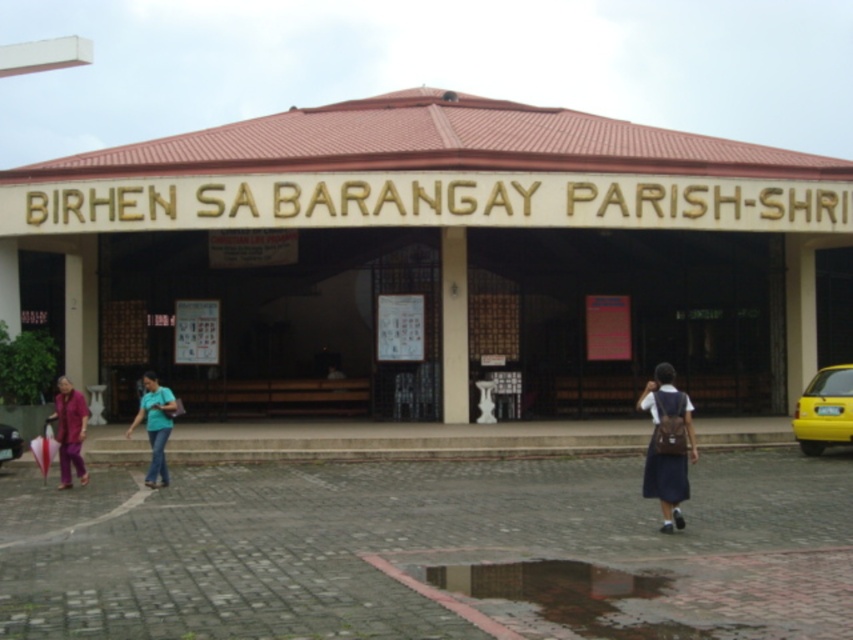
From the picture: Is matte purple pants at lower left further to camera compared to yellow matte car at lower right?

No, it is not.

Does matte purple pants at lower left have a smaller size compared to yellow matte car at lower right?

Incorrect, matte purple pants at lower left is not smaller in size than yellow matte car at lower right.

Between point (61, 435) and point (3, 429), which one is positioned behind?

The point (3, 429) is behind.

At what (x,y) coordinates should I click in order to perform the action: click on matte purple pants at lower left. Please return your answer as a coordinate pair (x, y). This screenshot has height=640, width=853. Looking at the image, I should click on (68, 429).

The height and width of the screenshot is (640, 853). Identify the location of brown wooden building at center. coord(440,257).

Describe the element at coordinates (440, 257) in the screenshot. The image size is (853, 640). I see `brown wooden building at center` at that location.

Where is `brown wooden building at center`? This screenshot has height=640, width=853. brown wooden building at center is located at coordinates point(440,257).

Who is shorter, matte purple pants at lower left or teal fabric shirt at center?

Standing shorter between the two is teal fabric shirt at center.

Who is more distant from viewer, [80,444] or [148,378]?

Positioned behind is point [148,378].

Find the location of `matte purple pants at lower left`. matte purple pants at lower left is located at coordinates (68, 429).